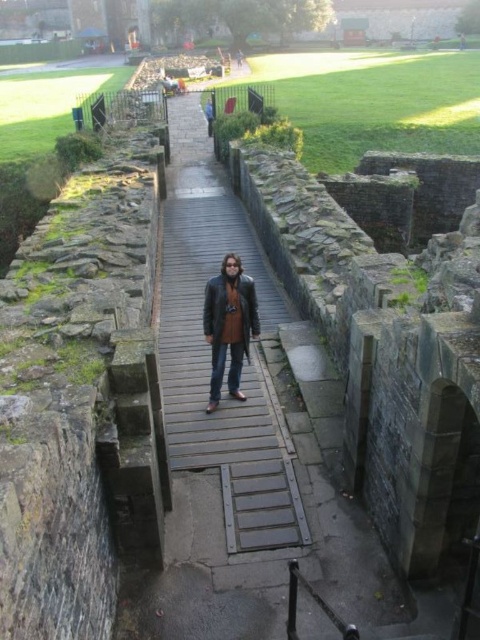
Question: Observing the image, what is the correct spatial positioning of wooden bridge at center in reference to brown leather jacket at center?

Choices:
 (A) left
 (B) right

Answer: (A)

Question: In this image, where is wooden bridge at center located relative to brown leather jacket at center?

Choices:
 (A) above
 (B) below

Answer: (A)

Question: Which object appears closest to the camera in this image?

Choices:
 (A) wooden bridge at center
 (B) brown leather jacket at center

Answer: (A)

Question: Among these objects, which one is nearest to the camera?

Choices:
 (A) brown leather jacket at center
 (B) wooden bridge at center

Answer: (B)

Question: Considering the relative positions of wooden bridge at center and brown leather jacket at center in the image provided, where is wooden bridge at center located with respect to brown leather jacket at center?

Choices:
 (A) below
 (B) above

Answer: (B)

Question: Which point is closer to the camera taking this photo?

Choices:
 (A) (248, 324)
 (B) (237, 538)

Answer: (B)